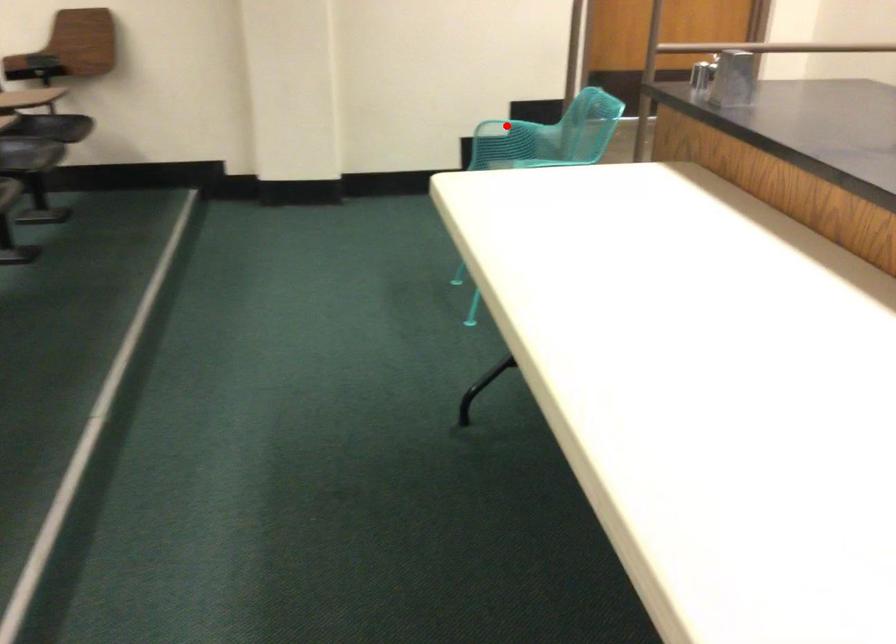
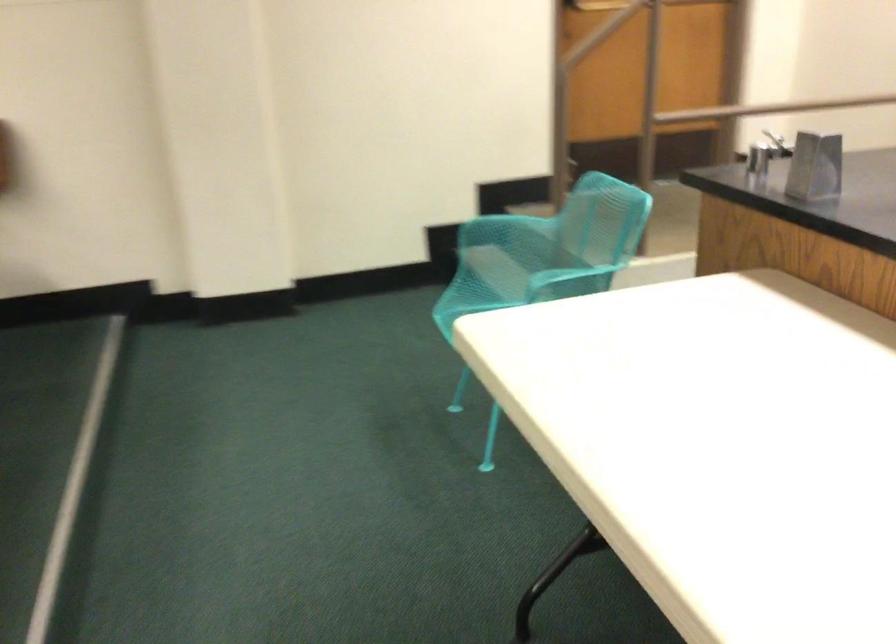
Where in the second image is the point corresponding to the highlighted location from the first image?

(494, 218)